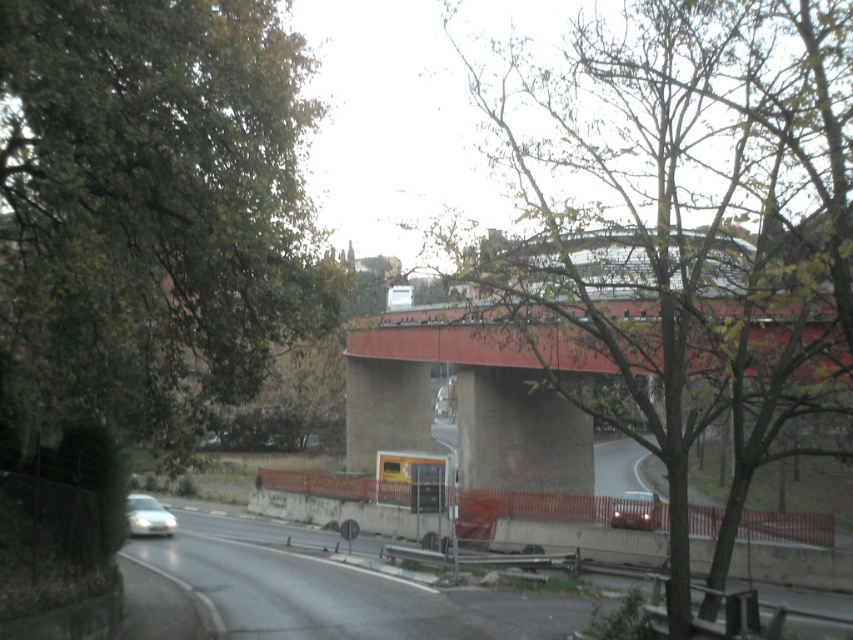
Does green leafy tree at center have a lesser height compared to silver metallic car at lower left?

Incorrect, green leafy tree at center's height does not fall short of silver metallic car at lower left's.

Consider the image. Which is below, green leafy tree at center or silver metallic car at lower left?

Positioned lower is silver metallic car at lower left.

Who is more distant from viewer, (x=662, y=420) or (x=161, y=518)?

The point (x=662, y=420) is more distant.

Identify the location of green leafy tree at center. This screenshot has width=853, height=640. (699, 218).

Is green leafy tree at left in front of green leafy tree at center?

Yes, it is in front of green leafy tree at center.

Is green leafy tree at left wider than green leafy tree at center?

Incorrect, green leafy tree at left's width does not surpass green leafy tree at center's.

Which is in front, point (312, 307) or point (717, 88)?

Positioned in front is point (312, 307).

At what (x,y) coordinates should I click in order to perform the action: click on green leafy tree at left. Please return your answer as a coordinate pair (x, y). Looking at the image, I should click on (154, 205).

Based on the photo, can you confirm if gray concrete highway at lower left is bigger than shiny silver car at center?

Indeed, gray concrete highway at lower left has a larger size compared to shiny silver car at center.

Between point (399, 605) and point (635, 518), which one is positioned behind?

The point (635, 518) is behind.

Between point (440, 600) and point (650, 529), which one is positioned behind?

Point (650, 529)

I want to click on gray concrete highway at lower left, so click(334, 588).